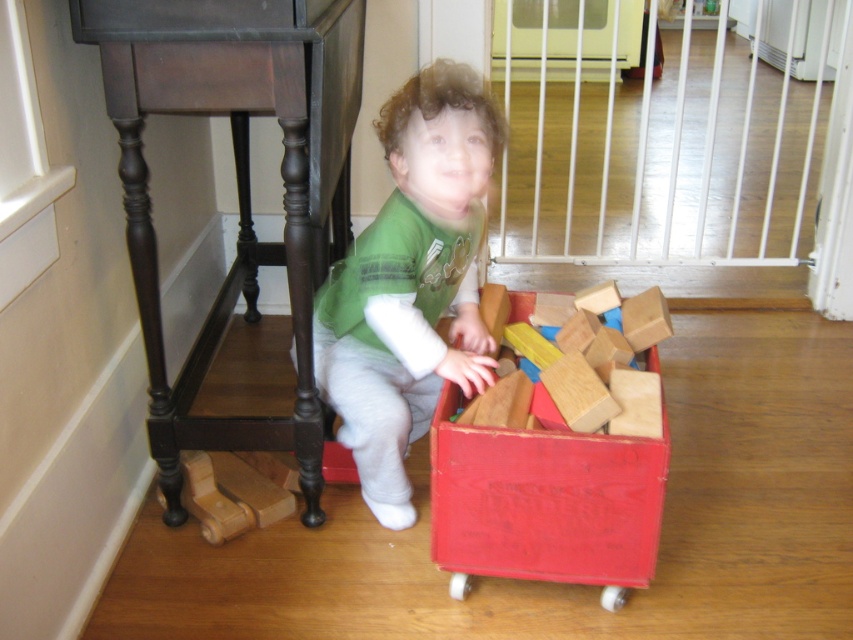
You are a parent trying to organize the child. You see the green matte shirt at center and the wooden blocks at center. Which item is taller?

The green matte shirt at center is taller than the wooden blocks at center.

You are a parent trying to dress your child. You have a green matte shirt at center and wooden blocks at center nearby. Which item is bigger in size?

The green matte shirt at center has a larger size compared to wooden blocks at center.

You are standing in the room and want to reach the point at coordinates [347,432]. The toy box is in your way. Can you step around it to get to the point?

The point at coordinates [347,432] is 1.66 meters away from the viewer, so you can step around the toy box to reach it as the distance allows enough space to maneuver around the obstruction.